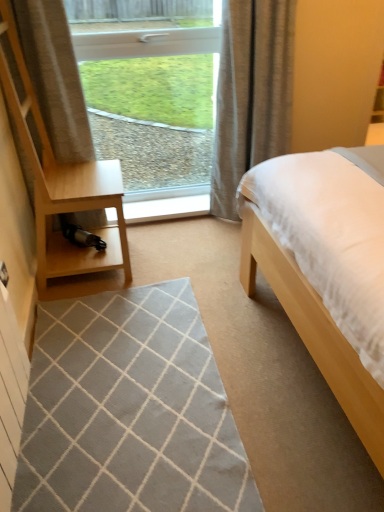
Question: Which is correct: gray woven mat at center is inside white plastic window at upper center, or outside of it?

Choices:
 (A) outside
 (B) inside

Answer: (A)

Question: Considering the positions of point (79, 365) and point (94, 146), is point (79, 365) closer or farther from the camera than point (94, 146)?

Choices:
 (A) farther
 (B) closer

Answer: (B)

Question: Based on their relative distances, which object is farther from the gray woven mat at center?

Choices:
 (A) light wood/dark finish dresser at left
 (B) gray textured curtain at upper right
 (C) white plastic window at upper center

Answer: (C)

Question: Estimate the real-world distances between objects in this image. Which object is closer to the gray woven mat at center?

Choices:
 (A) gray textured curtain at upper right
 (B) light wood/dark finish dresser at left
 (C) white plastic window at upper center

Answer: (B)